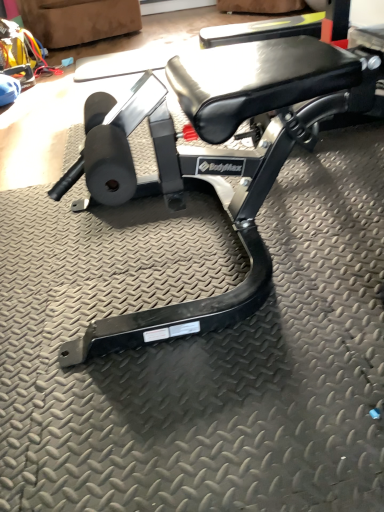
Question: From a real-world perspective, is suede-like brown swivel chair at upper left physically below black matte bench at center?

Choices:
 (A) yes
 (B) no

Answer: (B)

Question: Does suede-like brown swivel chair at upper left have a greater height compared to black matte bench at center?

Choices:
 (A) yes
 (B) no

Answer: (A)

Question: Can we say suede-like brown swivel chair at upper left lies outside black matte bench at center?

Choices:
 (A) yes
 (B) no

Answer: (A)

Question: Does suede-like brown swivel chair at upper left have a smaller size compared to black matte bench at center?

Choices:
 (A) no
 (B) yes

Answer: (B)

Question: Is suede-like brown swivel chair at upper left bigger than black matte bench at center?

Choices:
 (A) yes
 (B) no

Answer: (B)

Question: Is the depth of suede-like brown swivel chair at upper left less than that of black matte bench at center?

Choices:
 (A) yes
 (B) no

Answer: (B)

Question: Is black matte bench at center positioned beyond the bounds of suede-like brown swivel chair at upper left?

Choices:
 (A) no
 (B) yes

Answer: (B)

Question: From a real-world perspective, does black matte bench at center sit lower than suede-like brown swivel chair at upper left?

Choices:
 (A) no
 (B) yes

Answer: (B)

Question: Can you confirm if black matte bench at center is positioned to the left of suede-like brown swivel chair at upper left?

Choices:
 (A) yes
 (B) no

Answer: (B)

Question: Does black matte bench at center come behind suede-like brown swivel chair at upper left?

Choices:
 (A) yes
 (B) no

Answer: (B)

Question: Is there a large distance between black matte bench at center and suede-like brown swivel chair at upper left?

Choices:
 (A) no
 (B) yes

Answer: (B)

Question: Is black matte bench at center facing away from suede-like brown swivel chair at upper left?

Choices:
 (A) yes
 (B) no

Answer: (B)

Question: Looking at their shapes, would you say suede-like brown swivel chair at upper left is wider or thinner than black matte bench at center?

Choices:
 (A) thin
 (B) wide

Answer: (A)